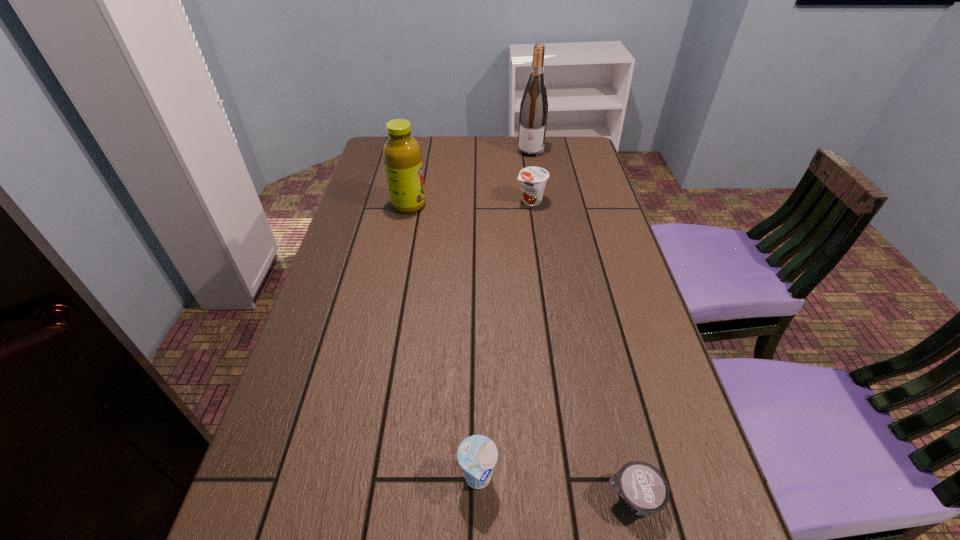
The height and width of the screenshot is (540, 960). Find the location of `the closest object to the fourth object from right to left`. the closest object to the fourth object from right to left is located at coordinates (642, 489).

At what (x,y) coordinates should I click in order to perform the action: click on yogurt that is the closest to the second object from left to right. Please return your answer as a coordinate pair (x, y). The height and width of the screenshot is (540, 960). Looking at the image, I should click on (642, 489).

Identify the location of yogurt that can be found as the second closest to the fourth object from right to left. This screenshot has height=540, width=960. (533, 179).

Locate an element on the screen. The height and width of the screenshot is (540, 960). free space that satisfies the following two spatial constraints: 1. on the back side of the second object from left to right; 2. on the left side of the tallest object is located at coordinates (479, 151).

The height and width of the screenshot is (540, 960). I want to click on free space that satisfies the following two spatial constraints: 1. on the front label of the second object from left to right; 2. on the left side of the second tallest object, so [354, 478].

This screenshot has width=960, height=540. I want to click on free space that satisfies the following two spatial constraints: 1. on the back side of the farthest yogurt; 2. on the left side of the second object from left to right, so click(x=479, y=201).

Find the location of `vacant space that satisfies the following two spatial constraints: 1. on the front side of the farthest object; 2. on the front label of the fruit juice`. vacant space that satisfies the following two spatial constraints: 1. on the front side of the farthest object; 2. on the front label of the fruit juice is located at coordinates (540, 205).

You are a GUI agent. You are given a task and a screenshot of the screen. Output one action in this format:
    pyautogui.click(x=<x>, y=<y>)
    Task: Click on the vacant point that satisfies the following two spatial constraints: 1. on the front side of the farthest yogurt; 2. on the front label of the second tallest object
    This screenshot has height=540, width=960.
    Given the screenshot: What is the action you would take?
    pyautogui.click(x=531, y=205)